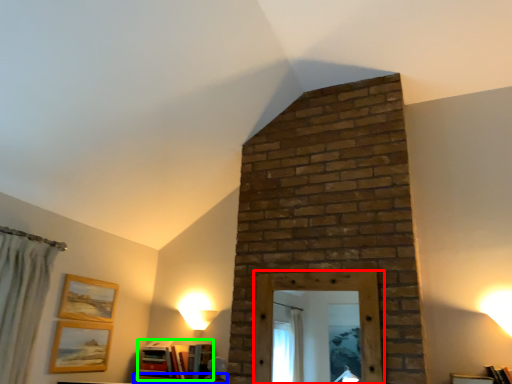
Question: Based on their relative distances, which object is nearer to window frame (highlighted by a red box)? Choose from furniture (highlighted by a blue box) and book (highlighted by a green box).

Choices:
 (A) furniture
 (B) book

Answer: (B)